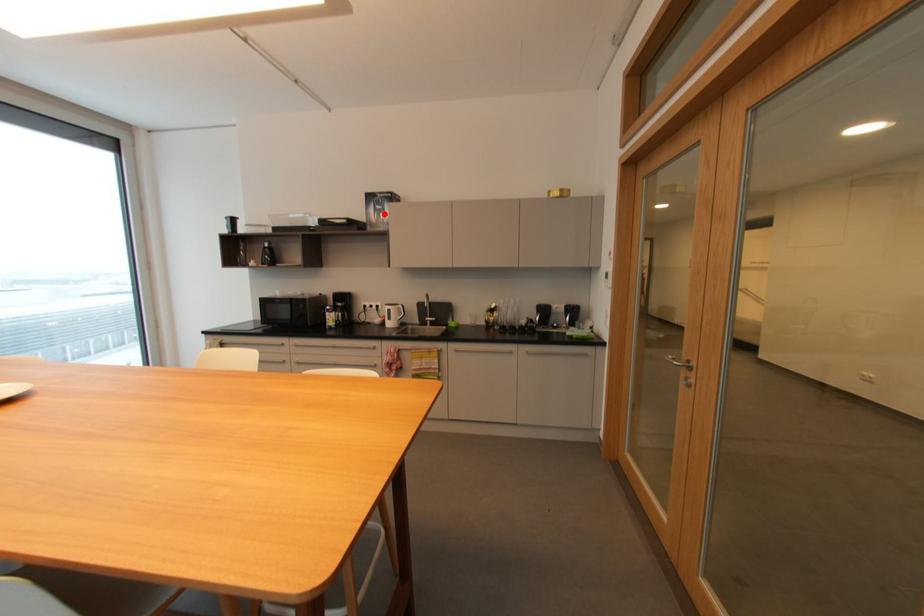
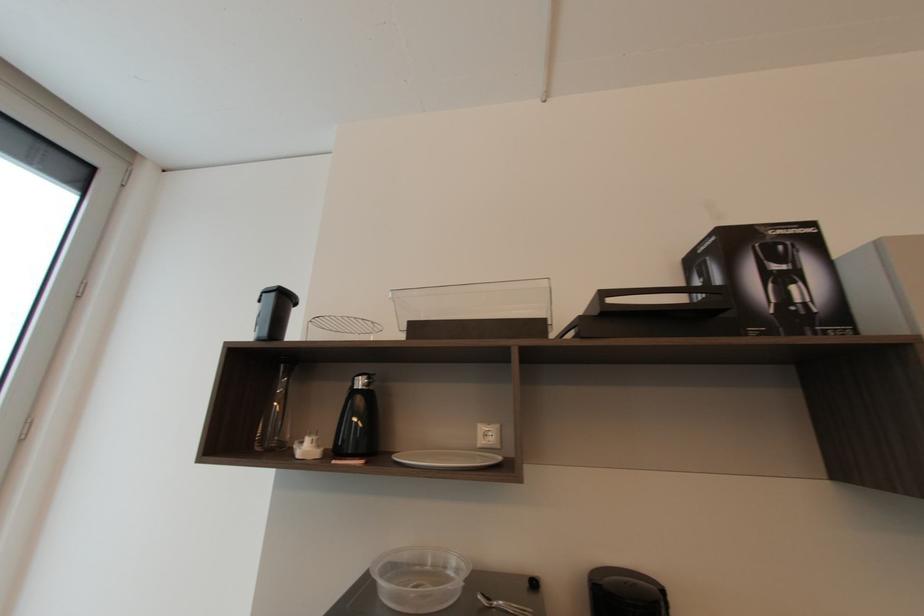
Question: I am providing you with two images of the same scene from different viewpoints. Image1 has a red point marked. In image2, the corresponding 3D location appears at what relative position? Reply with the corresponding letter.

Choices:
 (A) Closer
 (B) Farther

Answer: (B)